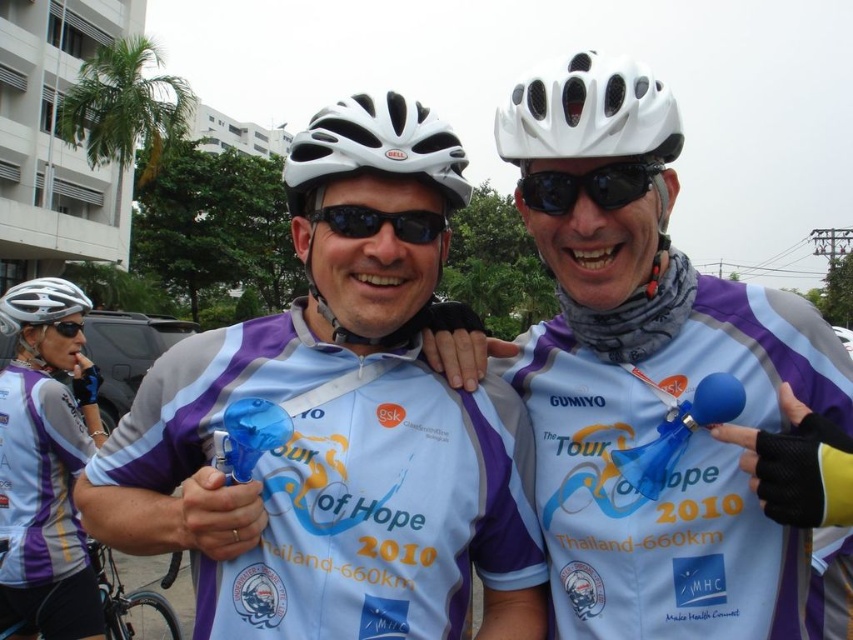
Which is more to the left, matte purple cycling jersey at left or matte silver helmet at upper left?

From the viewer's perspective, matte silver helmet at upper left appears more on the left side.

Can you confirm if matte purple cycling jersey at left is positioned above matte silver helmet at upper left?

No, matte purple cycling jersey at left is not above matte silver helmet at upper left.

Where is `matte purple cycling jersey at left`? Image resolution: width=853 pixels, height=640 pixels. matte purple cycling jersey at left is located at coordinates (45, 465).

Who is higher up, matte blue helmet at upper center or matte blue balloon at center?

matte blue balloon at center is higher up.

Is matte blue helmet at upper center bigger than matte blue balloon at center?

Indeed, matte blue helmet at upper center has a larger size compared to matte blue balloon at center.

Measure the distance between matte blue helmet at upper center and camera.

The distance of matte blue helmet at upper center from camera is 10.32 feet.

At what (x,y) coordinates should I click in order to perform the action: click on matte blue helmet at upper center. Please return your answer as a coordinate pair (x, y). The height and width of the screenshot is (640, 853). Looking at the image, I should click on (337, 429).

Who is positioned more to the right, white matte bicycle helmet at upper center or black matte goggles at upper left?

From the viewer's perspective, white matte bicycle helmet at upper center appears more on the right side.

Does white matte bicycle helmet at upper center have a greater height compared to black matte goggles at upper left?

Yes, white matte bicycle helmet at upper center is taller than black matte goggles at upper left.

Which is behind, point (619, 77) or point (80, 332)?

The point (80, 332) is behind.

Find the location of a particular element. white matte bicycle helmet at upper center is located at coordinates (589, 113).